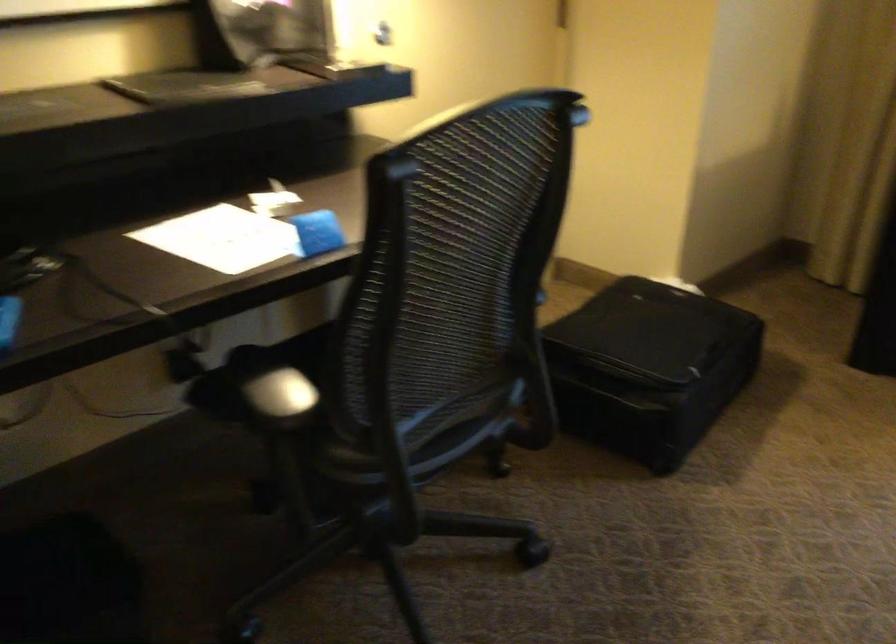
Where would you push the black chair armrest? Please return your answer as a coordinate pair (x, y).

(259, 371)